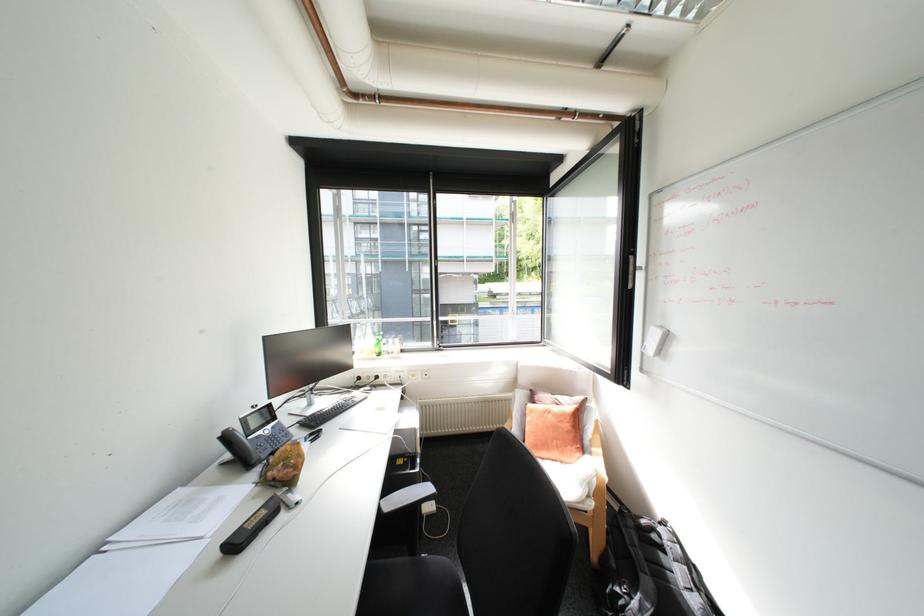
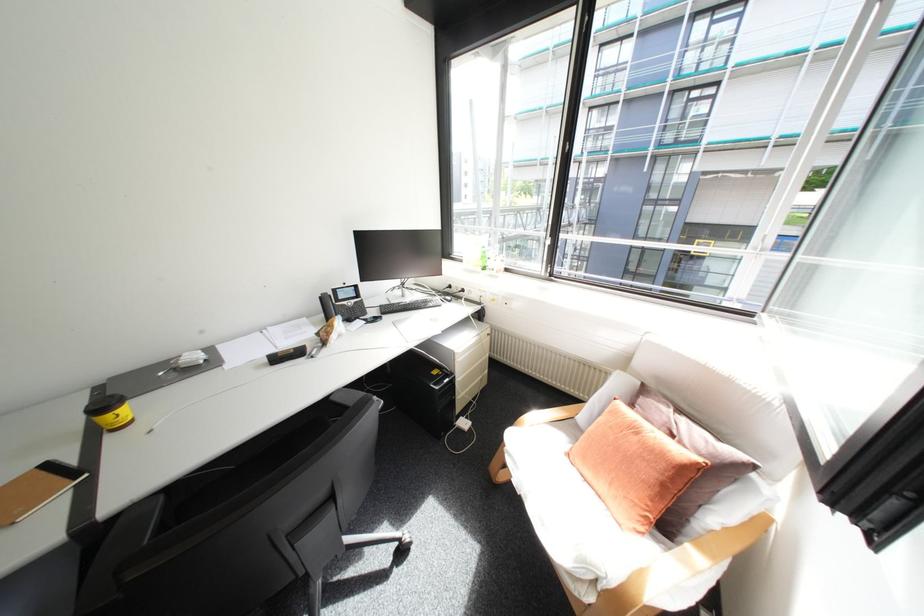
The point at [228,436] is marked in the first image. Where is the corresponding point in the second image?

(330, 296)